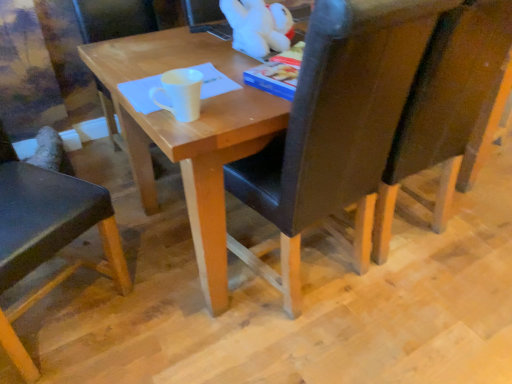
Question: In which direction should I rotate to look at matte wood chair at center, which ranks as the second chair in left-to-right order?

Choices:
 (A) left
 (B) right

Answer: (A)

Question: Should I look upward or downward to see black leather chair at center, the third chair viewed from the left?

Choices:
 (A) down
 (B) up

Answer: (B)

Question: Is matte wood chair at center, arranged as the 3th chair when viewed from the right, completely or partially outside of white plush toy at upper center?

Choices:
 (A) no
 (B) yes

Answer: (B)

Question: Can you confirm if matte wood chair at center, arranged as the 3th chair when viewed from the right, is smaller than white plush toy at upper center?

Choices:
 (A) yes
 (B) no

Answer: (B)

Question: Considering the relative positions of matte wood chair at center, which ranks as the second chair in left-to-right order, and white plush toy at upper center in the image provided, is matte wood chair at center, which ranks as the second chair in left-to-right order, to the left of white plush toy at upper center from the viewer's perspective?

Choices:
 (A) yes
 (B) no

Answer: (A)

Question: From a real-world perspective, is matte wood chair at center, which ranks as the second chair in left-to-right order, positioned over white plush toy at upper center based on gravity?

Choices:
 (A) yes
 (B) no

Answer: (B)

Question: Is matte wood chair at center, arranged as the 3th chair when viewed from the right, shorter than white plush toy at upper center?

Choices:
 (A) no
 (B) yes

Answer: (A)

Question: Can you confirm if matte wood chair at center, arranged as the 3th chair when viewed from the right, is wider than white plush toy at upper center?

Choices:
 (A) no
 (B) yes

Answer: (B)

Question: Considering the relative sizes of black leather chair at center, the third chair viewed from the left, and matte wood chair at center, which ranks as the second chair in left-to-right order, in the image provided, is black leather chair at center, the third chair viewed from the left, smaller than matte wood chair at center, which ranks as the second chair in left-to-right order,?

Choices:
 (A) no
 (B) yes

Answer: (A)

Question: Is black leather chair at center, the third chair viewed from the left, closer to the viewer compared to matte wood chair at center, which ranks as the second chair in left-to-right order?

Choices:
 (A) no
 (B) yes

Answer: (B)

Question: Is black leather chair at center, the third chair viewed from the left, looking in the opposite direction of matte wood chair at center, which ranks as the second chair in left-to-right order?

Choices:
 (A) yes
 (B) no

Answer: (B)

Question: From the image's perspective, is black leather chair at center, which is counted as the second chair, starting from the right, located above matte wood chair at center, arranged as the 3th chair when viewed from the right?

Choices:
 (A) yes
 (B) no

Answer: (B)

Question: Is black leather chair at center, the third chair viewed from the left, taller than matte wood chair at center, arranged as the 3th chair when viewed from the right?

Choices:
 (A) yes
 (B) no

Answer: (A)

Question: From a real-world perspective, is black leather chair at center, the third chair viewed from the left, located beneath matte wood chair at center, which ranks as the second chair in left-to-right order?

Choices:
 (A) no
 (B) yes

Answer: (A)

Question: Considering the relative sizes of black leather chair at center, which is counted as the second chair, starting from the right, and dark brown leather chair at right, the first chair when ordered from right to left, in the image provided, is black leather chair at center, which is counted as the second chair, starting from the right, thinner than dark brown leather chair at right, the first chair when ordered from right to left,?

Choices:
 (A) no
 (B) yes

Answer: (A)